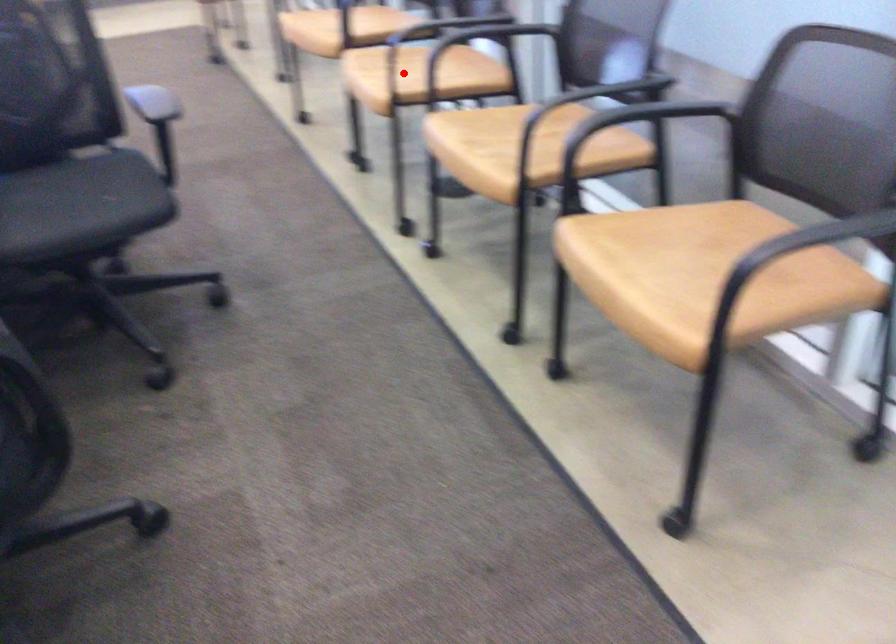
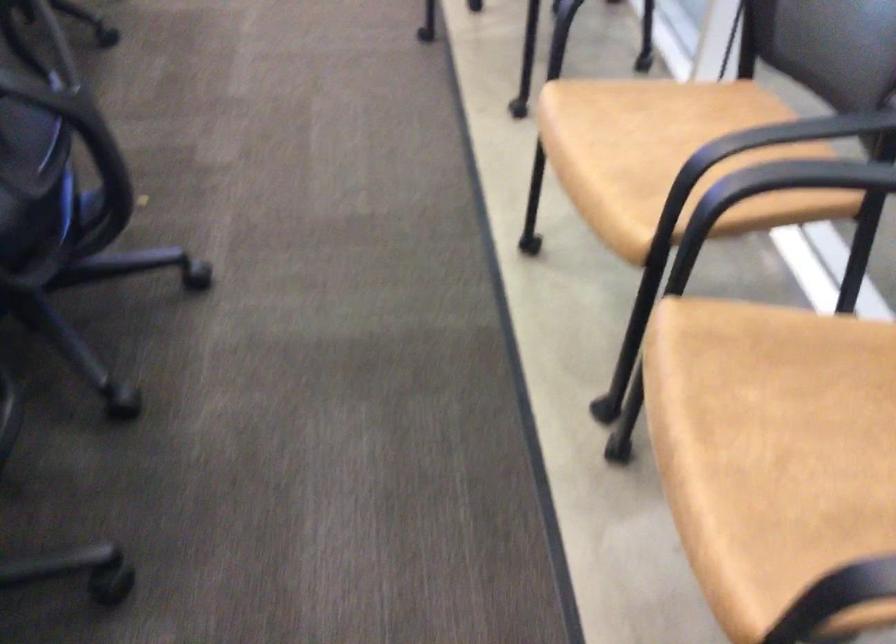
The point at the highlighted location is marked in the first image. Where is the corresponding point in the second image?

(791, 450)